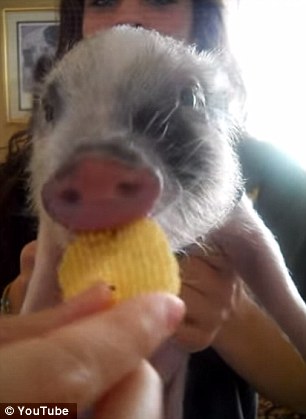
At what (x,y) coordinates should I click in order to perform the action: click on picture. Please return your answer as a coordinate pair (x, y). Image resolution: width=306 pixels, height=419 pixels. Looking at the image, I should click on (34, 40).